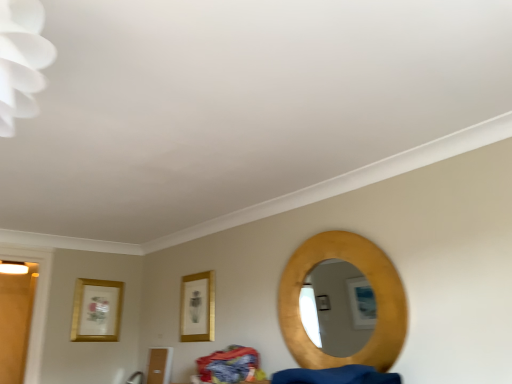
Question: Is gold metallic picture frame at center, the 1th picture frame in the front-to-back sequence, positioned with its back to gold textured mirror at right?

Choices:
 (A) no
 (B) yes

Answer: (A)

Question: Can you confirm if gold metallic picture frame at center, the 2th picture frame in the back-to-front sequence, is positioned to the left of gold textured mirror at right?

Choices:
 (A) no
 (B) yes

Answer: (B)

Question: Does gold metallic picture frame at center, the second picture frame when ordered from left to right, come in front of gold textured mirror at right?

Choices:
 (A) no
 (B) yes

Answer: (A)

Question: Does gold metallic picture frame at center, the 2th picture frame in the back-to-front sequence, come behind gold textured mirror at right?

Choices:
 (A) no
 (B) yes

Answer: (B)

Question: Does gold metallic picture frame at center, the second picture frame when ordered from left to right, have a lesser width compared to gold textured mirror at right?

Choices:
 (A) no
 (B) yes

Answer: (B)

Question: Does gold metallic picture frame at center, the 2th picture frame in the back-to-front sequence, have a greater width compared to gold textured mirror at right?

Choices:
 (A) yes
 (B) no

Answer: (B)

Question: Could you tell me if gold textured mirror at right is turned towards gold metallic picture frame at left, the 1th picture frame positioned from the left?

Choices:
 (A) no
 (B) yes

Answer: (A)

Question: Is gold textured mirror at right looking in the opposite direction of gold metallic picture frame at left, the 1th picture frame positioned from the left?

Choices:
 (A) no
 (B) yes

Answer: (A)

Question: Considering the relative sizes of gold textured mirror at right and gold metallic picture frame at left, the second picture frame from the right, in the image provided, is gold textured mirror at right thinner than gold metallic picture frame at left, the second picture frame from the right,?

Choices:
 (A) yes
 (B) no

Answer: (B)

Question: Considering the relative sizes of gold textured mirror at right and gold metallic picture frame at left, the second picture frame from the right, in the image provided, is gold textured mirror at right shorter than gold metallic picture frame at left, the second picture frame from the right,?

Choices:
 (A) yes
 (B) no

Answer: (B)

Question: From a real-world perspective, does gold textured mirror at right stand above gold metallic picture frame at left, the 1th picture frame positioned from the left?

Choices:
 (A) yes
 (B) no

Answer: (B)

Question: From a real-world perspective, is gold textured mirror at right beneath gold metallic picture frame at left, which is counted as the 2th picture frame, starting from the front?

Choices:
 (A) no
 (B) yes

Answer: (B)

Question: Considering the relative sizes of gold metallic picture frame at left, which is the first picture frame in back-to-front order, and gold metallic picture frame at center, arranged as the first picture frame when viewed from the right, in the image provided, is gold metallic picture frame at left, which is the first picture frame in back-to-front order, wider than gold metallic picture frame at center, arranged as the first picture frame when viewed from the right,?

Choices:
 (A) yes
 (B) no

Answer: (B)